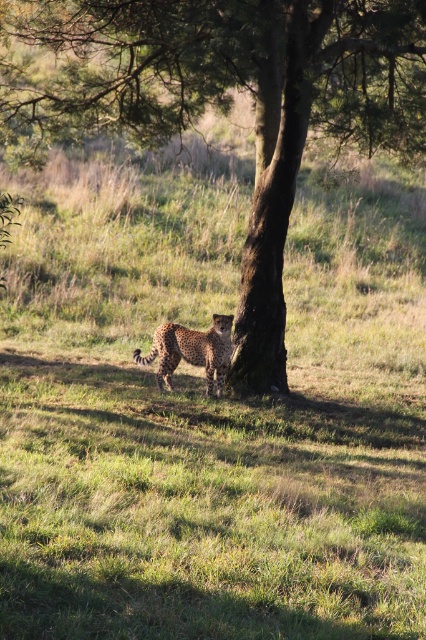
You are a photographer trying to capture the spotted fur cheetah at center and the brown rough tree at center in a single frame. Based on their sizes, which one should you focus on to ensure both are in the frame without cropping?

The brown rough tree at center is much taller than the spotted fur cheetah at center, so you should focus on the tree to ensure both are in the frame without cropping.

You are a wildlife photographer trying to capture a photo of the spotted fur cheetah at center. You notice the brown rough tree at center in the background. Based on their widths, which one do you think is wider?

The brown rough tree at center might be wider than spotted fur cheetah at center according to the description.

You are a photographer trying to capture the spotted fur cheetah at center and the brown rough tree at center in a single frame. Based on their sizes, which one should you focus on to ensure both are clearly visible in the photo?

The brown rough tree at center is bigger than the spotted fur cheetah at center, so you should focus on the brown rough tree at center to ensure both are clearly visible in the photo.